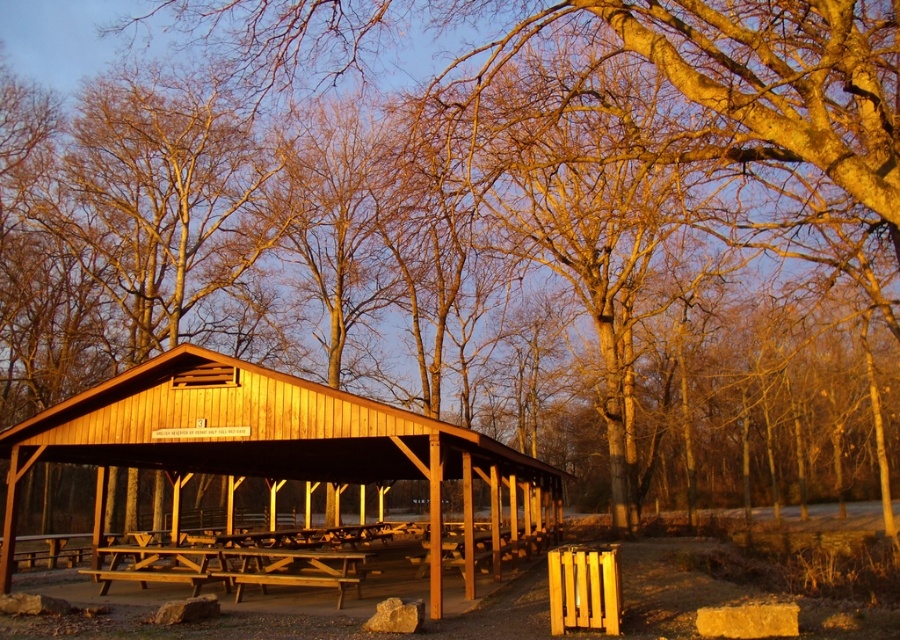
You are planning to host a small gathering and need to decide whether the wooden picnic table at center can fit inside the wooden hut at center. Based on the size comparison provided, can the picnic table fit inside the hut?

The wooden hut at center is bigger than the wooden picnic table at center, so the picnic table can fit inside the hut.